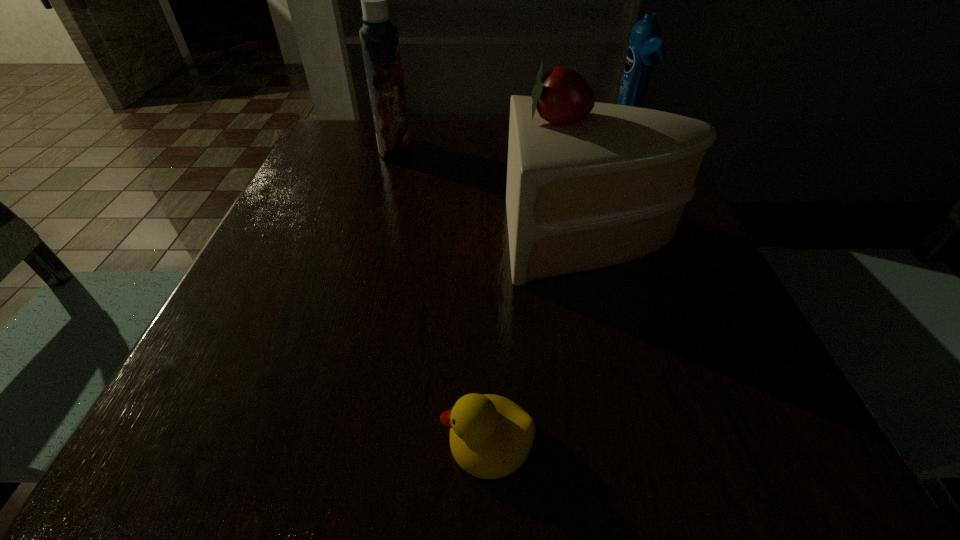
Choose which watch is the second nearest neighbor to the rightmost gold watch. Please provide its 2D coordinates. Your answer should be formatted as a tuple, i.e. [(x, y)], where the tuple contains the x and y coordinates of a point satisfying the conditions above.

[(511, 230)]

Image resolution: width=960 pixels, height=540 pixels. Identify the location of gold watch that stands as the second closest to the smallest gold watch. (348, 165).

The width and height of the screenshot is (960, 540). I want to click on gold watch that is the closest to the nearest gray watch, so click(x=527, y=357).

The height and width of the screenshot is (540, 960). In order to click on the second closest gray watch to the farthest gold watch in this screenshot , I will do `click(681, 279)`.

Select which gray watch is the closest to the smallest gold watch. Please provide its 2D coordinates. Your answer should be formatted as a tuple, i.e. [(x, y)], where the tuple contains the x and y coordinates of a point satisfying the conditions above.

[(511, 230)]

Where is `free point that satisfies the following two spatial constraints: 1. on the face of the second nearest gray watch; 2. on the face of the rightmost gold watch`? free point that satisfies the following two spatial constraints: 1. on the face of the second nearest gray watch; 2. on the face of the rightmost gold watch is located at coordinates (714, 356).